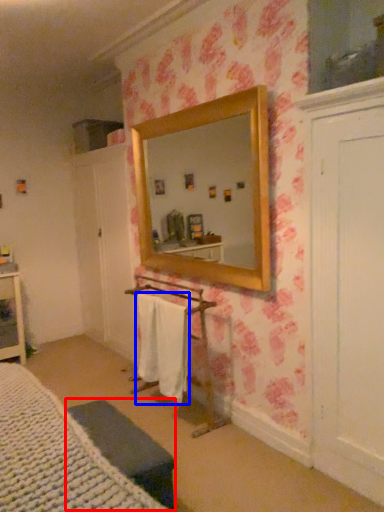
Question: Which object appears closest to the camera in this image, furniture (highlighted by a red box) or bath towel (highlighted by a blue box)?

Choices:
 (A) furniture
 (B) bath towel

Answer: (A)